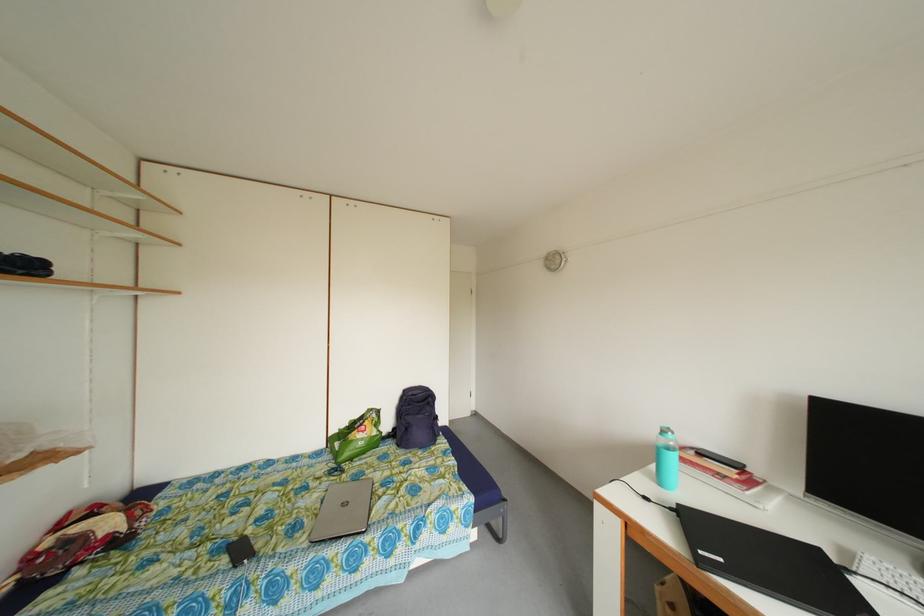
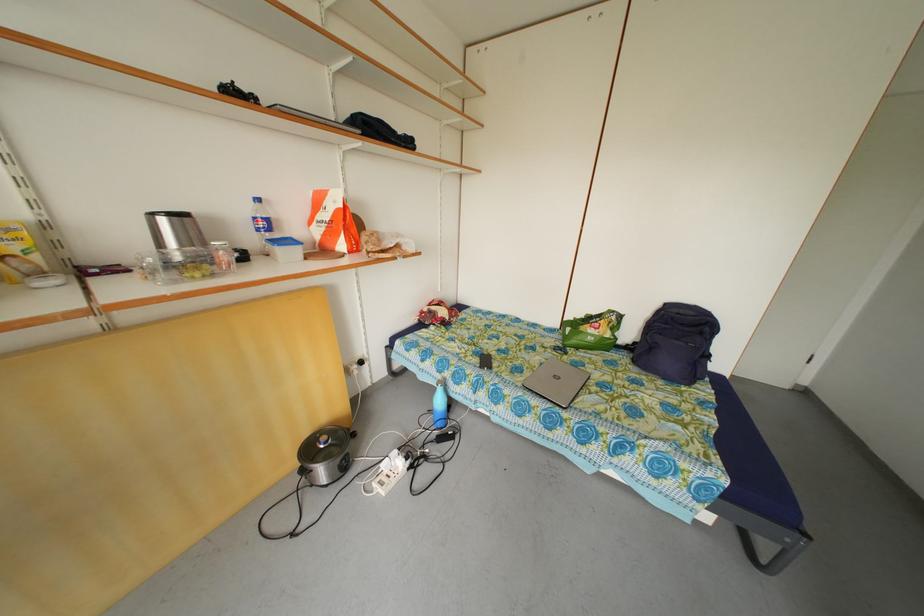
Find the pixel in the second image that matches the point at 371,438 in the first image.

(602, 334)